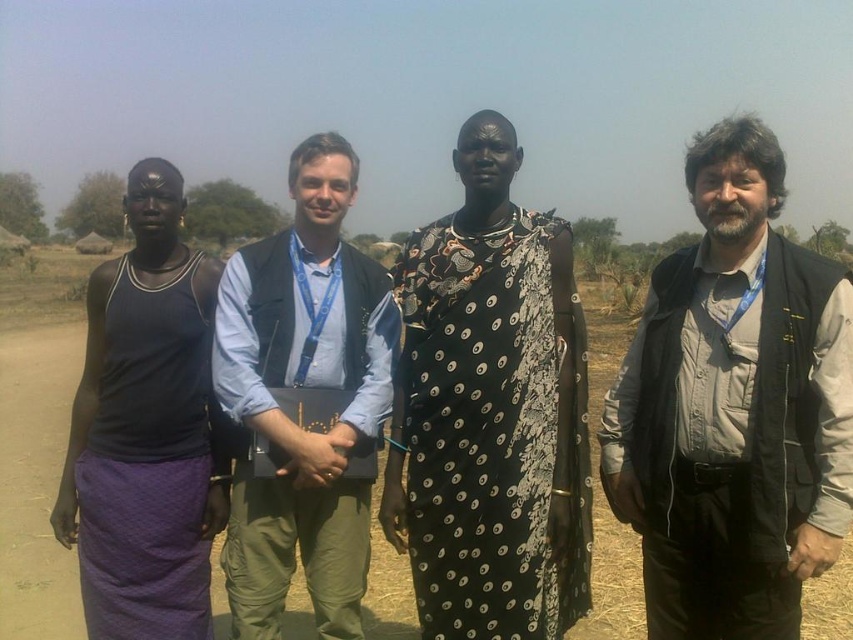
Question: Which point appears farthest from the camera in this image?

Choices:
 (A) (614, 545)
 (B) (735, 362)

Answer: (A)

Question: Which is farther from the gray fabric vest at center?

Choices:
 (A) brown dirt field at center
 (B) black printed dress at center
 (C) blue fabric vest at center

Answer: (A)

Question: Is gray fabric vest at center to the right of blue fabric vest at center from the viewer's perspective?

Choices:
 (A) no
 (B) yes

Answer: (B)

Question: Can you confirm if gray fabric vest at center is positioned to the left of brown dirt field at center?

Choices:
 (A) yes
 (B) no

Answer: (B)

Question: Which point appears farthest from the camera in this image?

Choices:
 (A) (646, 442)
 (B) (86, 426)
 (C) (463, 390)

Answer: (B)

Question: Is blue fabric vest at center bigger than brown dirt field at center?

Choices:
 (A) no
 (B) yes

Answer: (A)